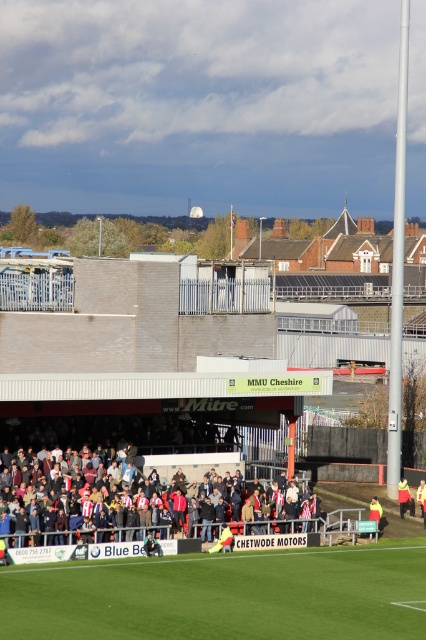
Which is below, yellow fabric jacket at lower right or yellow fabric jacket at lower center?

yellow fabric jacket at lower center

This screenshot has height=640, width=426. What do you see at coordinates (403, 497) in the screenshot?
I see `yellow fabric jacket at lower right` at bounding box center [403, 497].

Where is `yellow fabric jacket at lower right`? yellow fabric jacket at lower right is located at coordinates (403, 497).

Which is behind, point (71, 529) or point (400, 488)?

The point (400, 488) is more distant.

Between point (189, 452) and point (408, 500), which one is positioned behind?

Point (408, 500)

Find the location of a particular element. Image resolution: width=426 pixels, height=640 pixels. red fabric crowd at center is located at coordinates (138, 500).

What do you see at coordinates (138, 500) in the screenshot? The height and width of the screenshot is (640, 426). I see `red fabric crowd at center` at bounding box center [138, 500].

I want to click on red fabric crowd at center, so click(138, 500).

This screenshot has width=426, height=640. In order to click on red fabric crowd at center in this screenshot , I will do pyautogui.click(x=138, y=500).